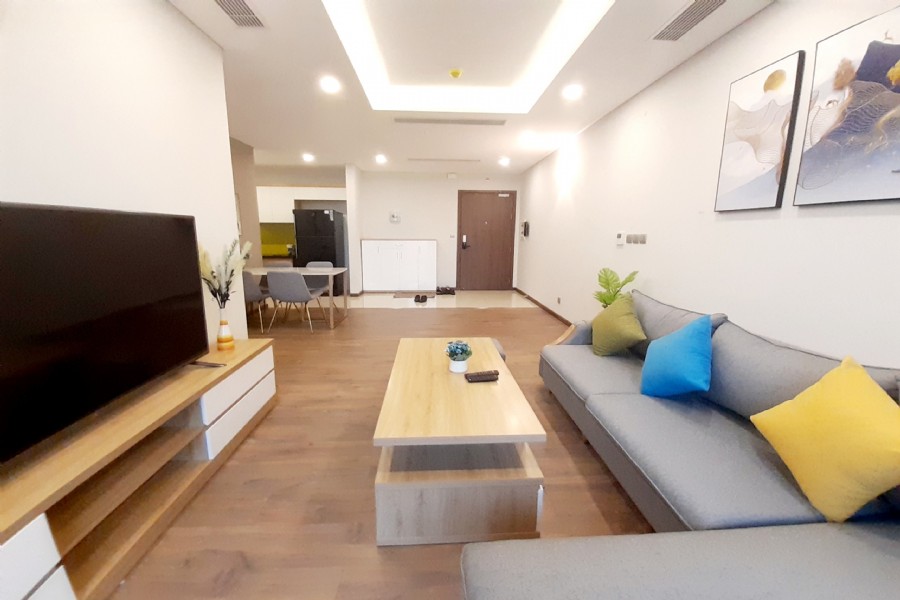
Identify the location of bottom shelf of television stand. 136,530.